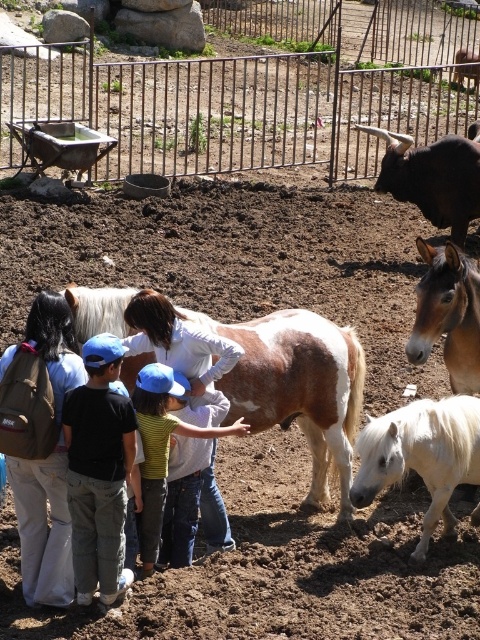
Question: Which object is farther from the camera taking this photo?

Choices:
 (A) brown and white textured horse at center
 (B) brushed metal fence at upper center

Answer: (B)

Question: Which object appears closest to the camera in this image?

Choices:
 (A) black cotton shirt at center
 (B) brushed metal fence at upper center
 (C) black glossy cow at upper right
 (D) brown glossy horse at center right

Answer: (A)

Question: Considering the relative positions of brown soil at center and brown backpack at left in the image provided, where is brown soil at center located with respect to brown backpack at left?

Choices:
 (A) right
 (B) left

Answer: (A)

Question: Estimate the real-world distances between objects in this image. Which object is closer to the brown glossy horse at center right?

Choices:
 (A) black cotton shirt at center
 (B) striped shirt at center

Answer: (B)

Question: Observing the image, what is the correct spatial positioning of brown soil at center in reference to striped shirt at center?

Choices:
 (A) left
 (B) right

Answer: (B)

Question: Is brown and white textured horse at center positioned behind striped shirt at center?

Choices:
 (A) yes
 (B) no

Answer: (A)